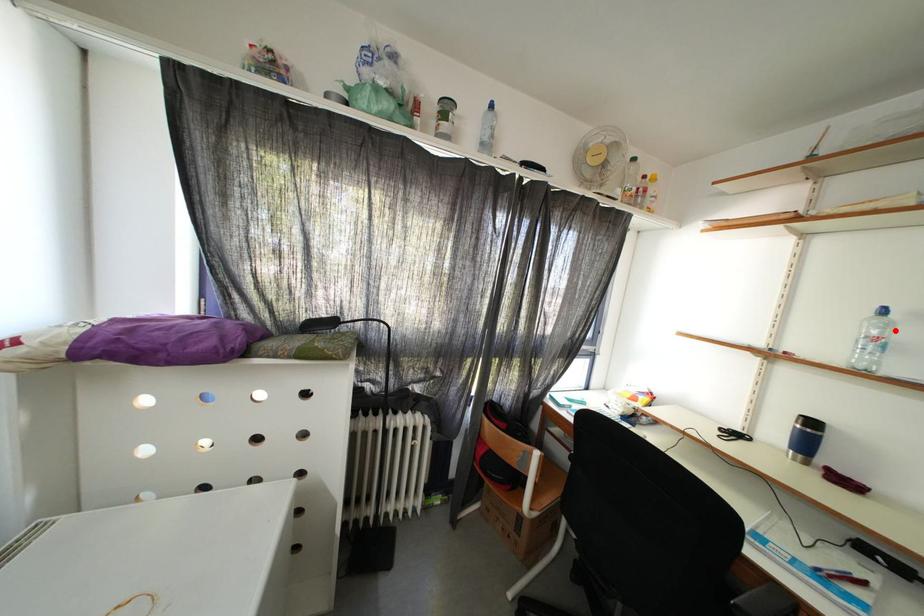
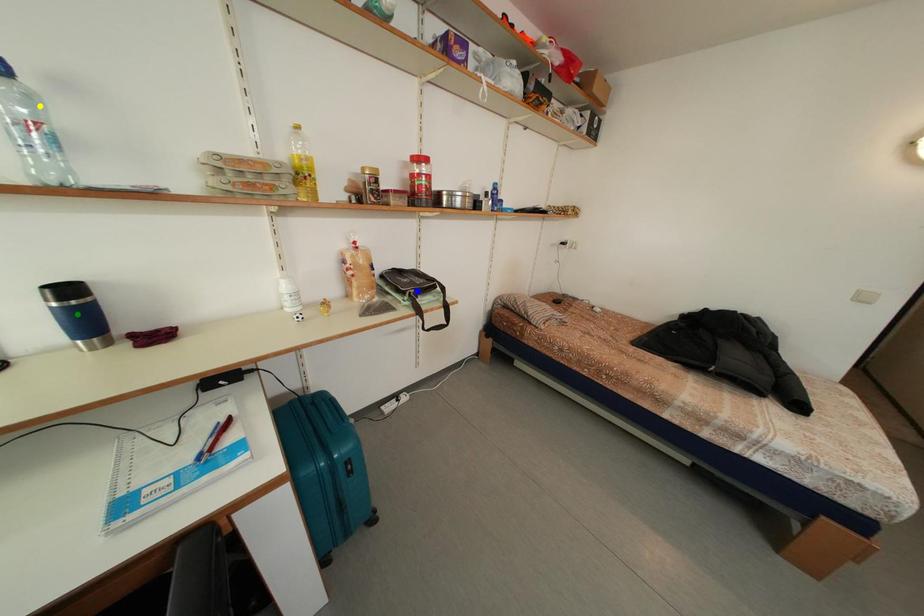
Question: I am providing you with two images of the same scene from different viewpoints. A red point is marked on the first image. You are given multiple points on the second image. Which mark in image 2 goes with the point in image 1?

Choices:
 (A) yellow point
 (B) green point
 (C) blue point

Answer: (A)